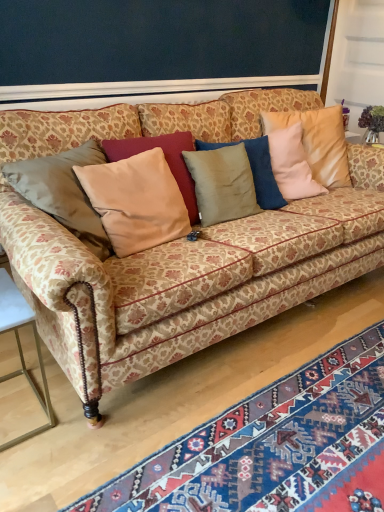
You are a GUI agent. You are given a task and a screenshot of the screen. Output one action in this format:
    pyautogui.click(x=<x>, y=<y>)
    Task: Click on the vacant area to the right of gold metallic table at lower left
    This screenshot has width=384, height=512.
    Given the screenshot: What is the action you would take?
    pyautogui.click(x=88, y=424)